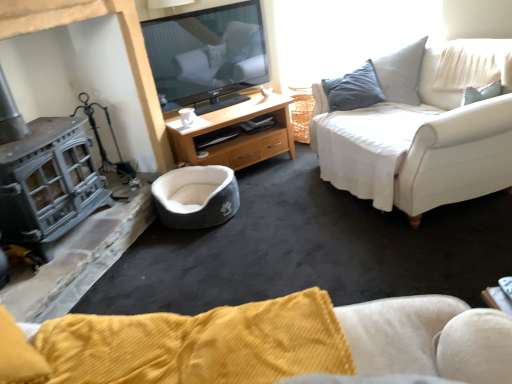
At what (x,y) coordinates should I click in order to perform the action: click on vacant area that lies to the right of gray plush pet bed at center. Please return your answer as a coordinate pair (x, y). This screenshot has height=384, width=512. Looking at the image, I should click on (271, 205).